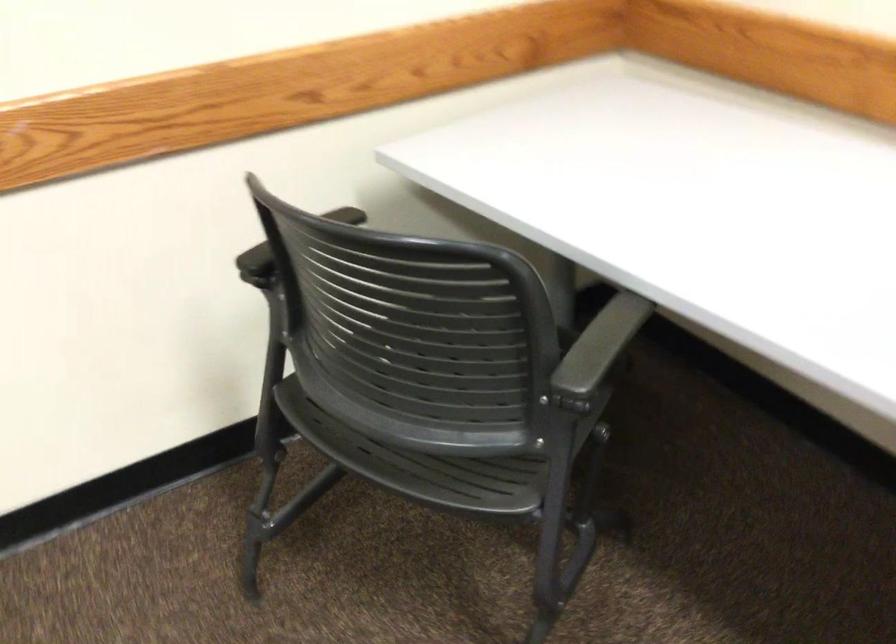
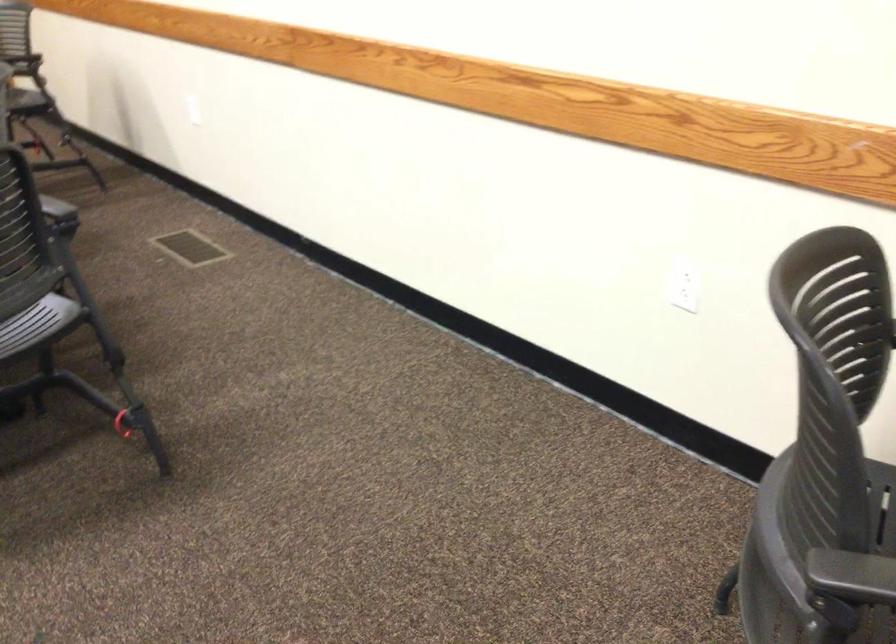
Where in the second image is the point corresponding to point (574, 375) from the first image?

(850, 573)